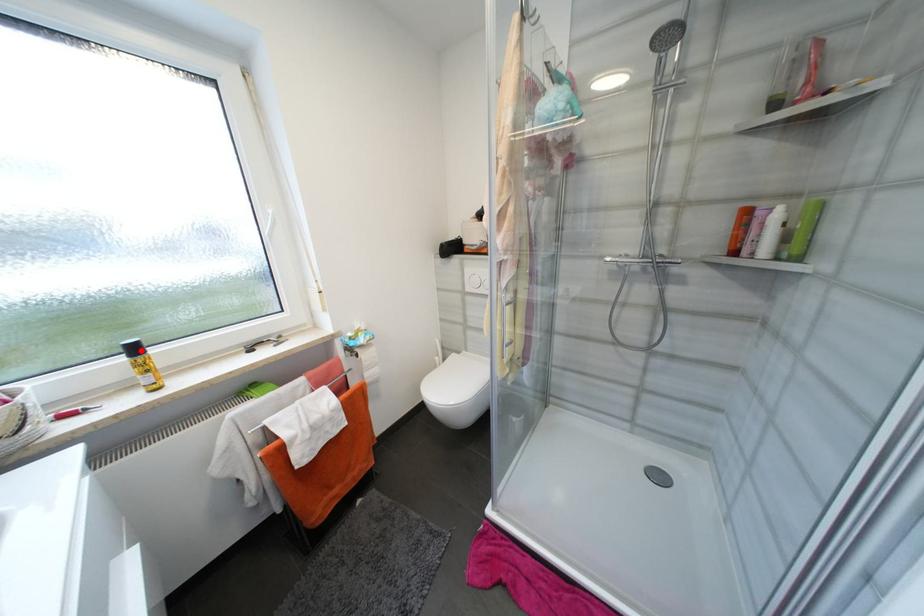
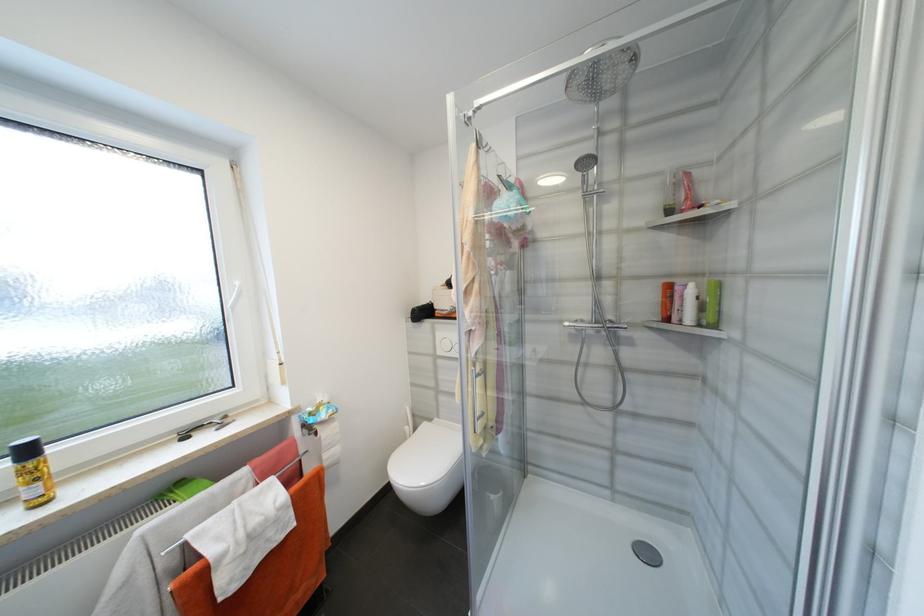
In the second image, find the point that corresponds to the highlighted location in the first image.

(33, 453)